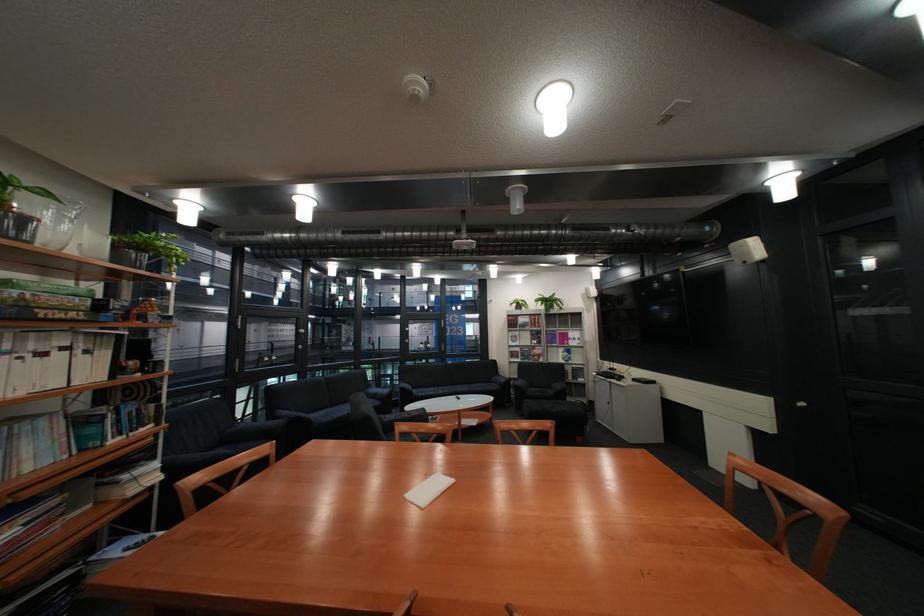
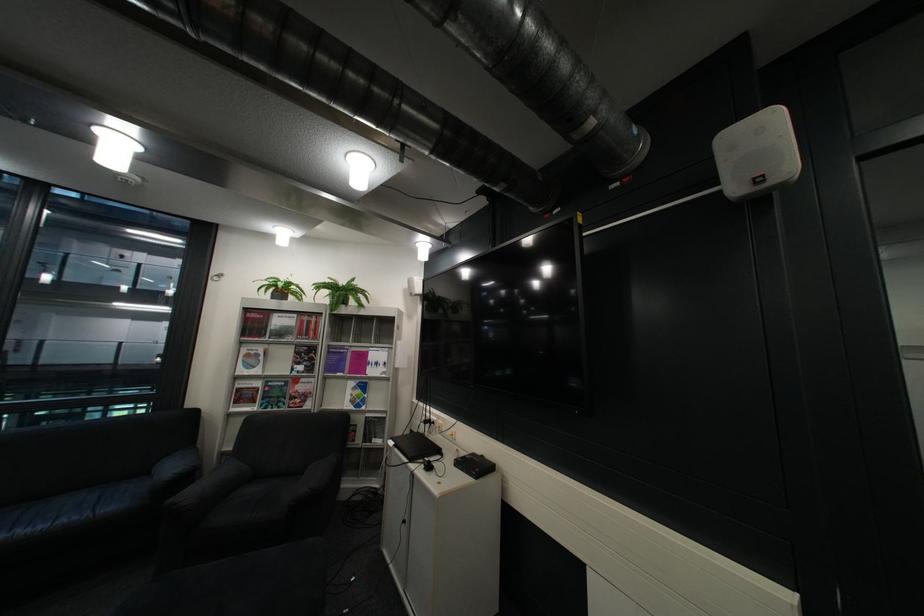
Find the pixel in the second image that matches the point at 527,352 in the first image.

(254, 390)